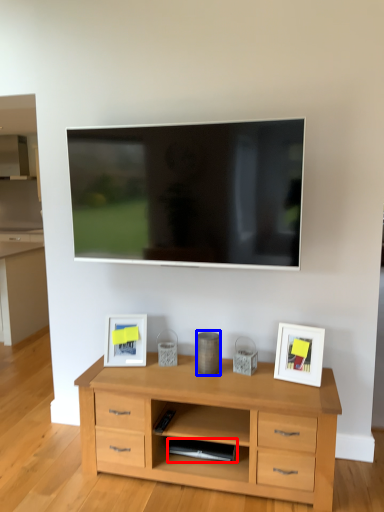
Question: Which object appears farthest to the camera in this image, appliance (highlighted by a red box) or appliance (highlighted by a blue box)?

Choices:
 (A) appliance
 (B) appliance

Answer: (B)